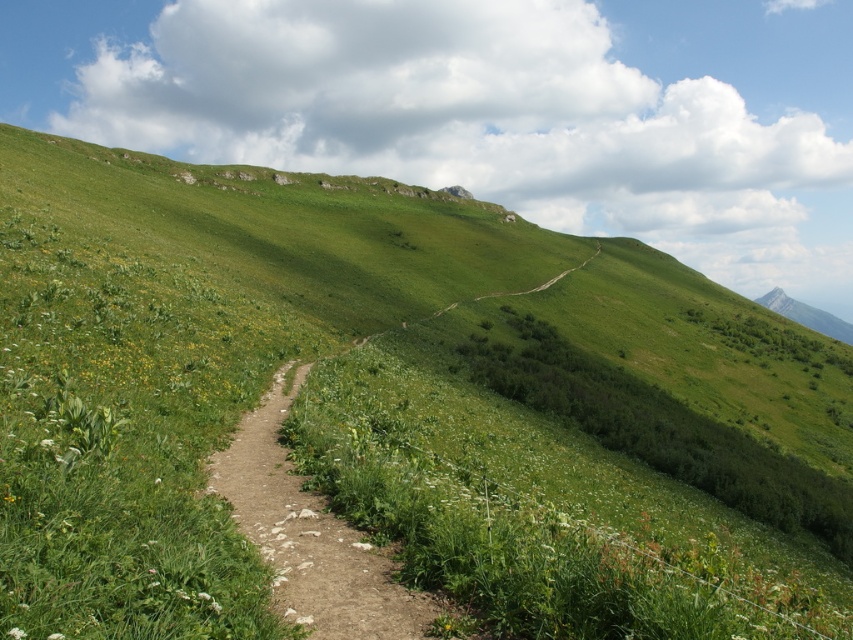
You are planning a hiking trip and see the dirt path at center and the gray rocky mountain at upper right in the image. Which of these two features is smaller in size?

The dirt path at center is smaller in size compared to the gray rocky mountain at upper right.

You are planning to walk along the dirt path at center and the gray rocky mountain at upper right. Which one is narrower?

The dirt path at center has a lesser width compared to the gray rocky mountain at upper right, so the dirt path at center is narrower.